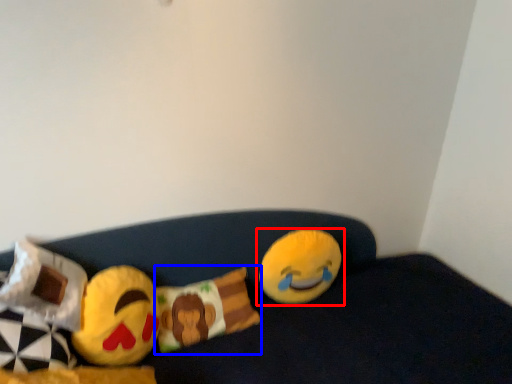
Question: Which of the following is the closest to the observer, toy (highlighted by a red box) or pillow (highlighted by a blue box)?

Choices:
 (A) toy
 (B) pillow

Answer: (B)